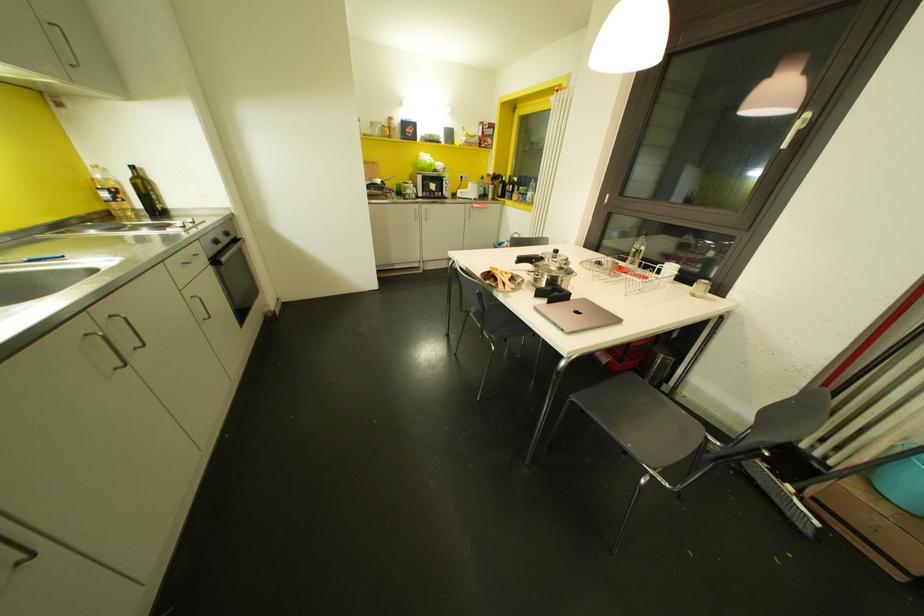
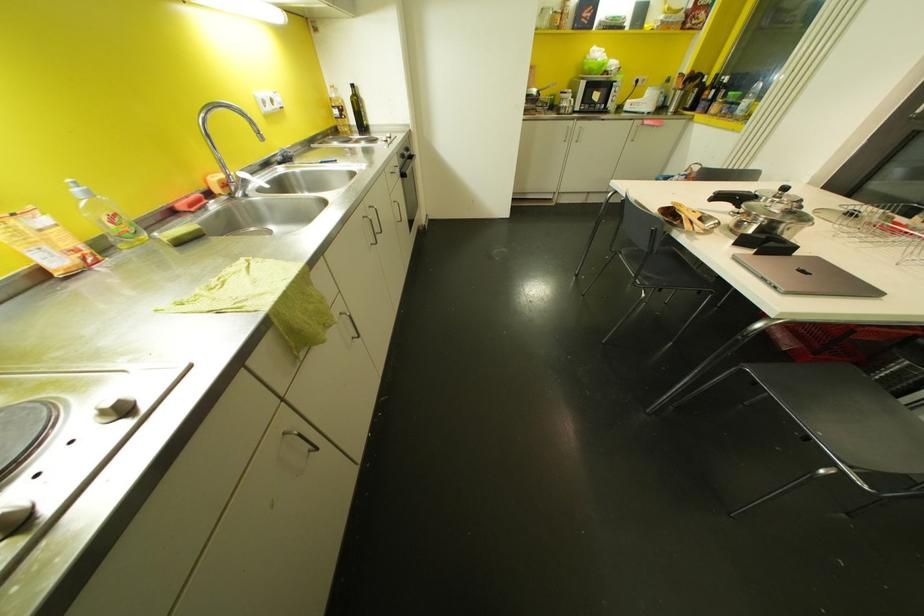
The point at (132,168) is marked in the first image. Where is the corresponding point in the second image?

(353, 84)